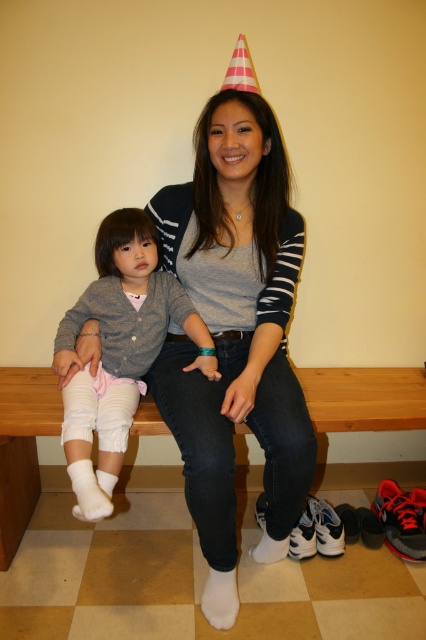
Question: Does matte gray sweater at center have a greater width compared to white fluffy socks at left?

Choices:
 (A) no
 (B) yes

Answer: (A)

Question: Can you confirm if matte gray sweater at center is thinner than white fluffy socks at left?

Choices:
 (A) yes
 (B) no

Answer: (A)

Question: Among these objects, which one is nearest to the camera?

Choices:
 (A) white fluffy socks at left
 (B) matte gray sweater at center

Answer: (B)

Question: Which of the following is the farthest from the observer?

Choices:
 (A) white fluffy socks at left
 (B) matte gray sweater at center

Answer: (A)

Question: Which object is farther from the camera taking this photo?

Choices:
 (A) matte gray sweater at center
 (B) white fluffy socks at left

Answer: (B)

Question: From the image, what is the correct spatial relationship of matte gray sweater at center in relation to white fluffy socks at left?

Choices:
 (A) above
 (B) below

Answer: (B)